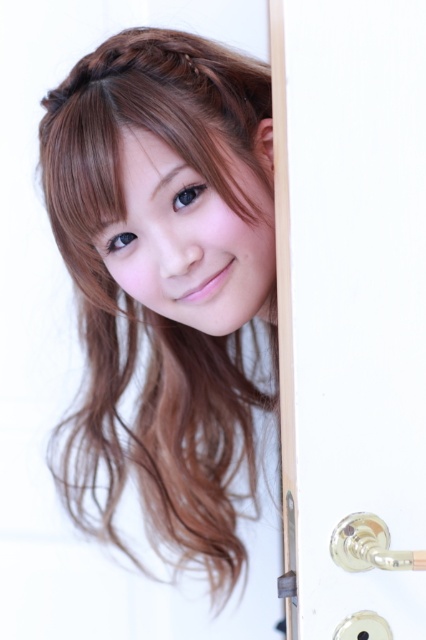
You are trying to determine which object is wider between the gold metallic door handle at right and the gold metallic lock at right. Based on the scene, can you tell which one is wider?

The gold metallic door handle at right is wider than the gold metallic lock at right according to the description.

From the picture: You are a photographer trying to capture a shot of the smooth brown hair at center and the silver metallic door handle at lower right. Which object is located more to the left in the image?

The smooth brown hair at center is positioned on the left side of the silver metallic door handle at lower right, so it is more to the left.

You are a locksmith trying to install a new lock on the door. The existing gold metallic door handle at right and gold metallic lock at right are both in the way. Which one do you need to remove first to access the back of the lock?

Since the gold metallic door handle at right is taller than the gold metallic lock at right, you should remove the gold metallic door handle at right first to access the back of the lock.